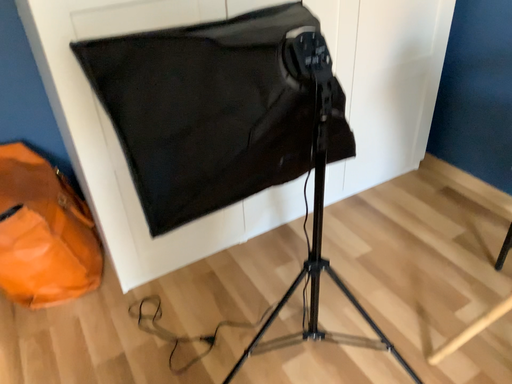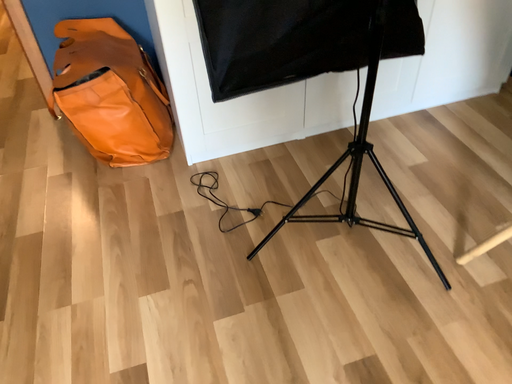
Question: How did the camera likely rotate when shooting the video?

Choices:
 (A) rotated left
 (B) rotated right

Answer: (A)